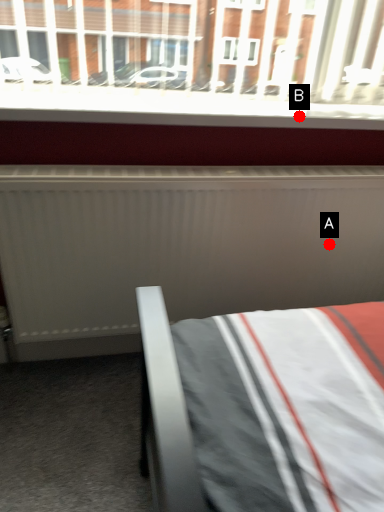
Question: Two points are circled on the image, labeled by A and B beside each circle. Which of the following is the closest to the observer?

Choices:
 (A) A is closer
 (B) B is closer

Answer: (B)